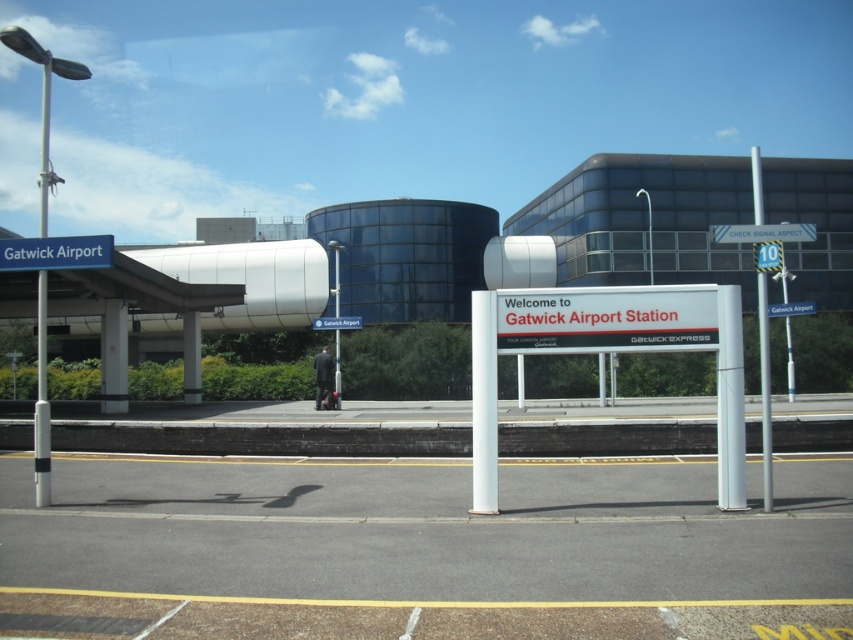
Question: Which point is farther to the camera?

Choices:
 (A) (814, 308)
 (B) (521, 310)

Answer: (A)

Question: Which point is farther from the camera taking this photo?

Choices:
 (A) (804, 301)
 (B) (753, 220)
 (C) (335, 328)
 (D) (329, 323)

Answer: (B)

Question: Which object is farther from the camera taking this photo?

Choices:
 (A) white metallic pole at center
 (B) white glossy pole at center
 (C) blue metallic sign at upper center
 (D) white smooth pillar at center

Answer: (C)

Question: Can you confirm if white metallic sign at center is wider than white plastic sign at center?

Choices:
 (A) yes
 (B) no

Answer: (A)

Question: Where is white plastic sign at center located in relation to metallic pole at left in the image?

Choices:
 (A) left
 (B) right

Answer: (B)

Question: Does white plastic sign at center have a smaller size compared to white smooth pillar at center?

Choices:
 (A) no
 (B) yes

Answer: (A)